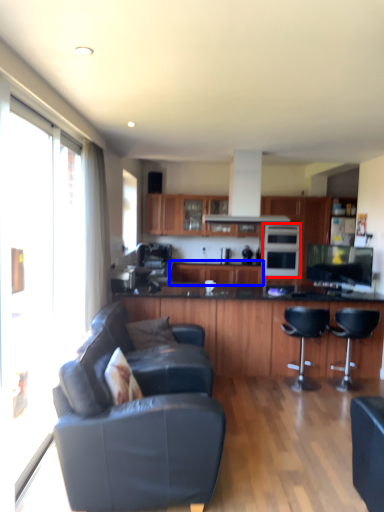
Question: Which object appears farthest to the camera in this image, oven (highlighted by a red box) or cabinetry (highlighted by a blue box)?

Choices:
 (A) oven
 (B) cabinetry

Answer: (B)